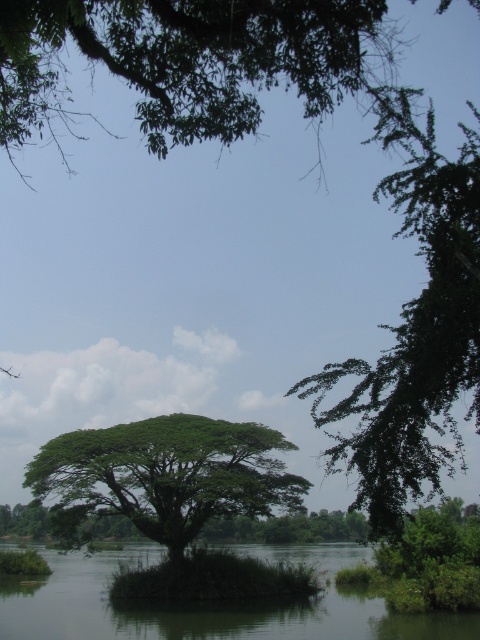
Question: Which point appears farthest from the camera in this image?

Choices:
 (A) (136, 436)
 (B) (22, 84)

Answer: (A)

Question: Observing the image, what is the correct spatial positioning of green leafy tree at upper center in reference to green leafy lake at center?

Choices:
 (A) above
 (B) below

Answer: (A)

Question: Which object is the closest to the green leafy tree at center?

Choices:
 (A) green leafy lake at center
 (B) green leafy tree at upper center

Answer: (A)

Question: In this image, where is green leafy tree at upper center located relative to green leafy tree at center?

Choices:
 (A) above
 (B) below

Answer: (A)

Question: Which object is the farthest from the green leafy tree at center?

Choices:
 (A) green leafy lake at center
 (B) green leafy tree at upper center

Answer: (B)

Question: Can you confirm if green leafy tree at center is positioned below green leafy lake at center?

Choices:
 (A) yes
 (B) no

Answer: (B)